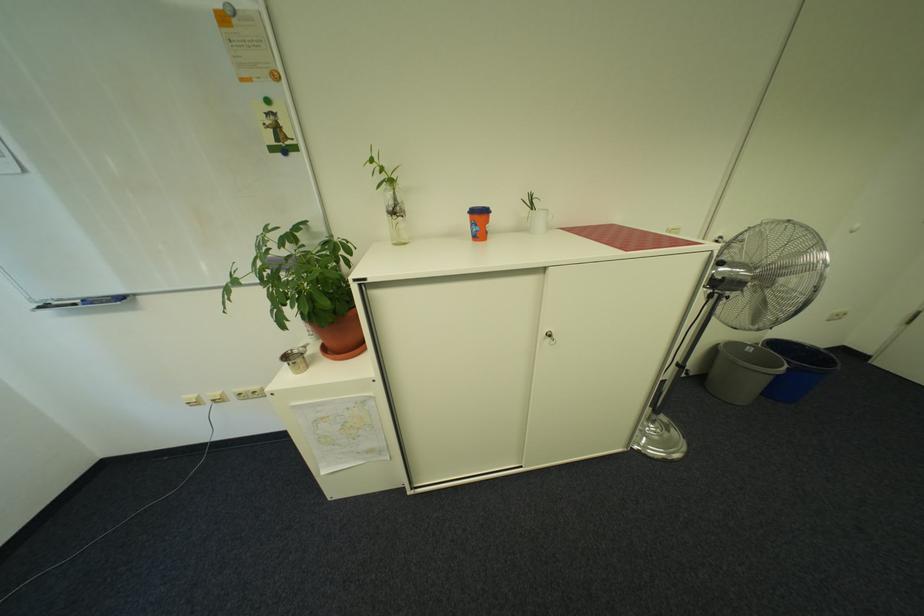
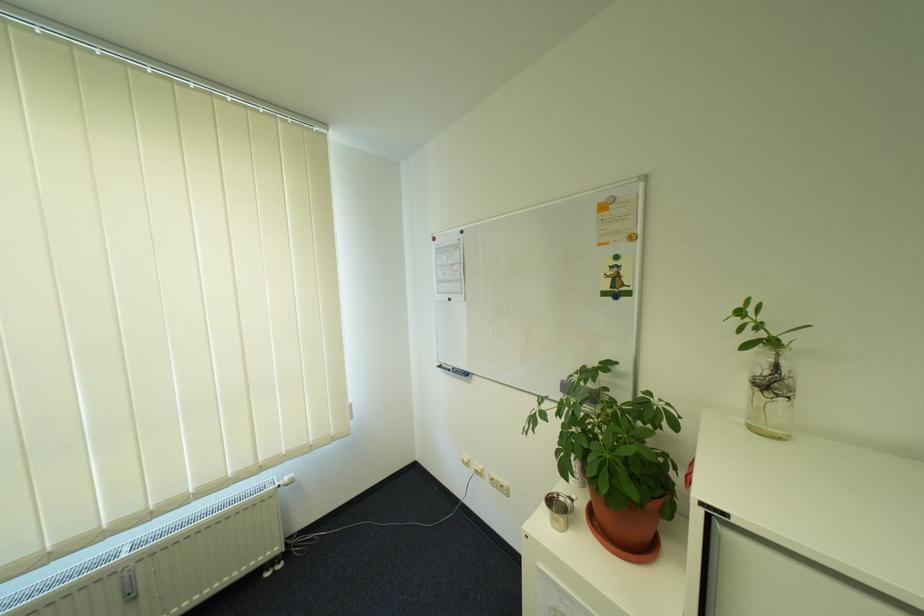
The point at (x=406, y=200) is marked in the first image. Where is the corresponding point in the second image?

(785, 369)